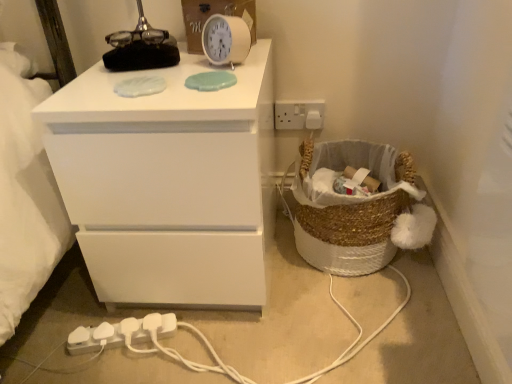
What are the coordinates of `vacant area located to the right-hand side of white plastic extension cord at lower left` in the screenshot? It's located at (196, 347).